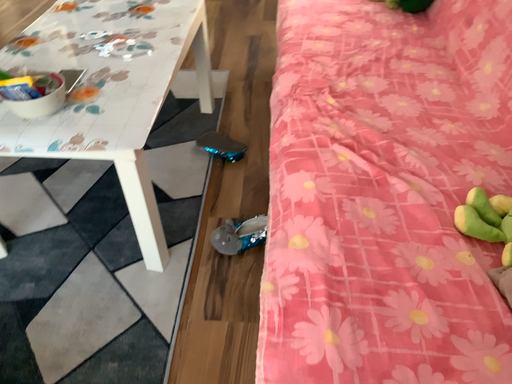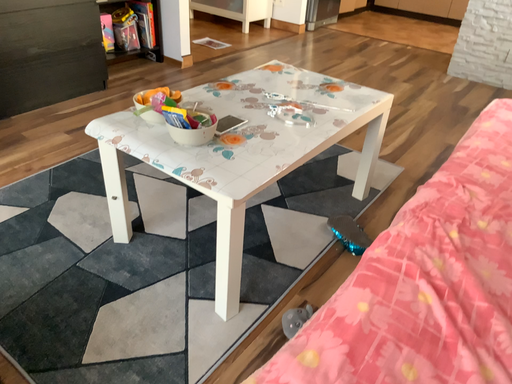
Question: Which way did the camera rotate in the video?

Choices:
 (A) rotated left
 (B) rotated right

Answer: (A)